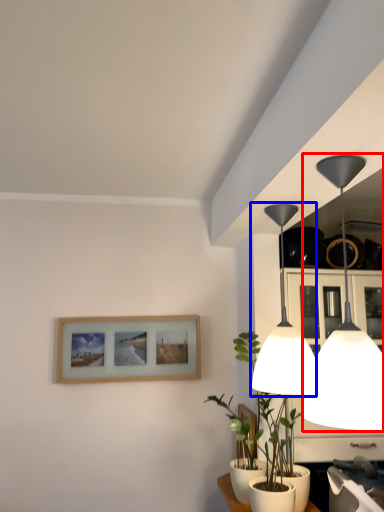
Question: Which point is closer to the camera, lamp (highlighted by a red box) or lamp (highlighted by a blue box)?

Choices:
 (A) lamp
 (B) lamp

Answer: (A)